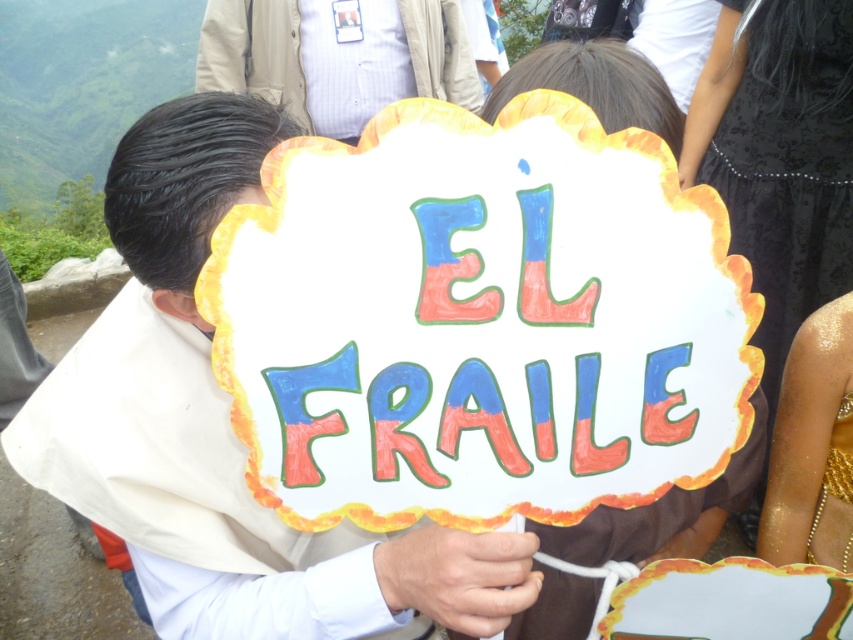
Is point (215, 145) farther from camera compared to point (378, 68)?

No, (215, 145) is closer to viewer.

Between white paper sign at center and light brown jacket at center, which one has less height?

light brown jacket at center

Identify the location of white paper sign at center. (215, 394).

Locate an element on the screen. white paper sign at center is located at coordinates (215, 394).